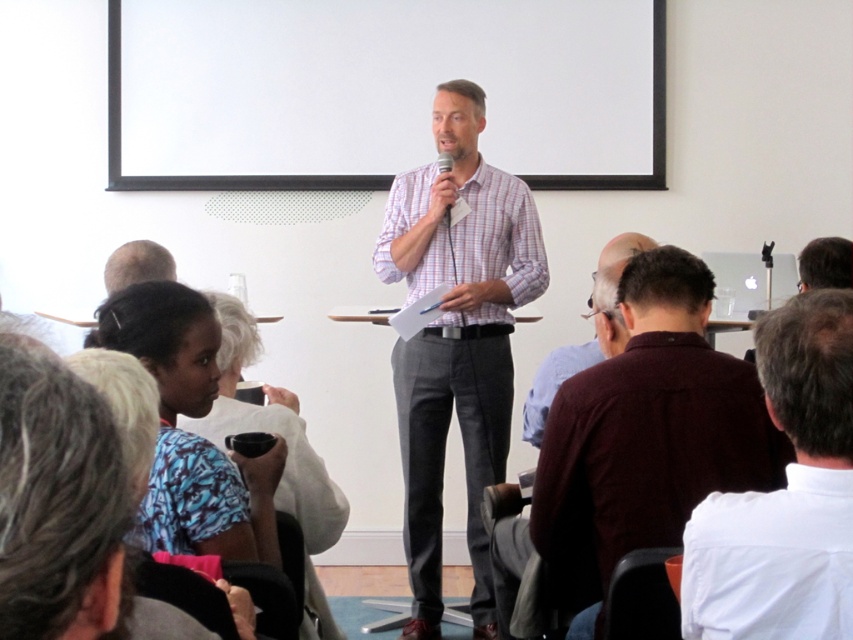
You are a photographer in the audience. You want to take a photo of the plaid cotton shirt at center and the light brown hair at upper left. Which object should you focus on first if you want to capture both in the same frame without moving the camera?

The plaid cotton shirt at center is larger in size than light brown hair at upper left, so you should focus on the plaid cotton shirt at center first to ensure it is in clear view before adjusting for the smaller light brown hair at upper left.

You are an attendee at the presentation. You notice a point marked at coordinates (456,339) in the image. What object is located at this point?

The point at coordinates (456,339) corresponds to the plaid cotton shirt at center.

You are an event organizer who needs to ensure all attendees are visible on the camera. The camera is positioned to capture the front row. Given that the plaid cotton shirt at center and dark maroon shirt at center are both in the front row, which shirt might be more likely to block the view of others due to its size?

The plaid cotton shirt at center has a larger width than the dark maroon shirt at center, so it might block the view more due to its size.